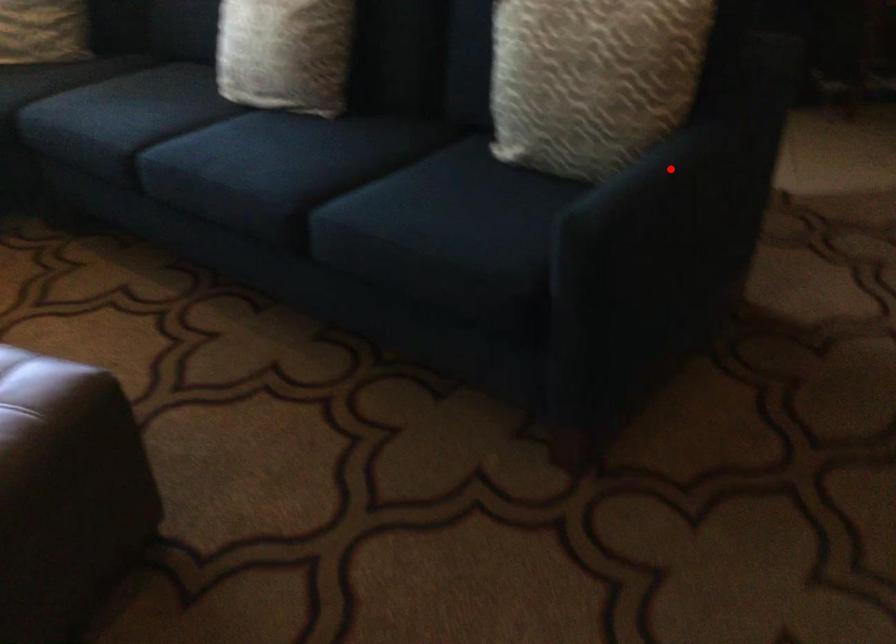
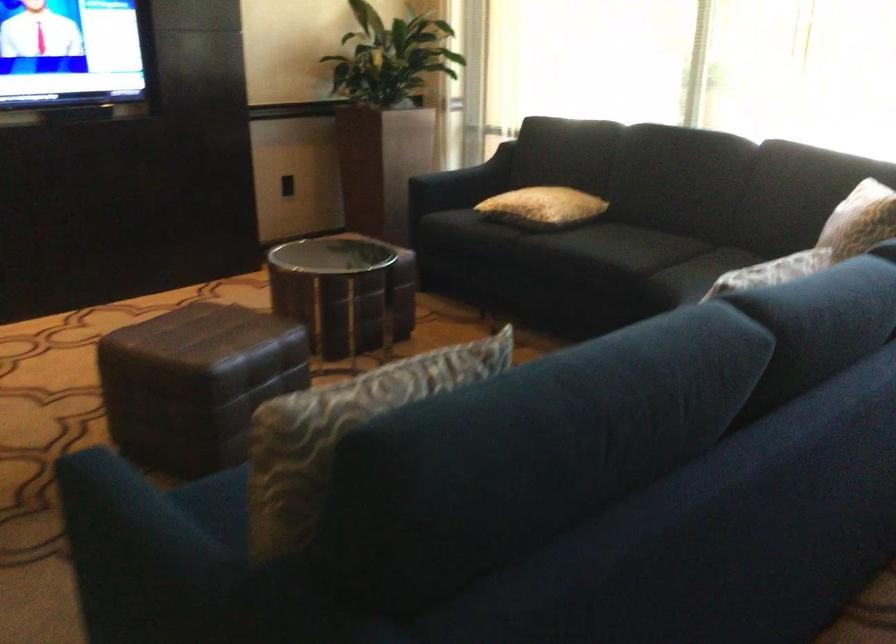
Question: A red point is marked in image1. In image2, is the corresponding 3D point closer to the camera or farther? Reply with the corresponding letter.

Choices:
 (A) The corresponding 3D point is closer.
 (B) The corresponding 3D point is farther.

Answer: (A)